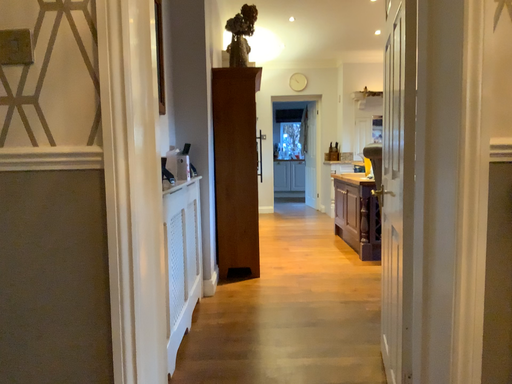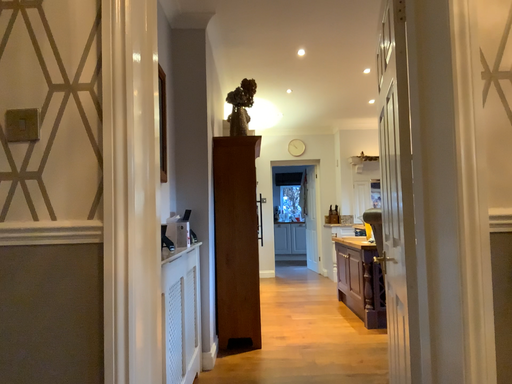
Question: How did the camera likely rotate when shooting the video?

Choices:
 (A) rotated downward
 (B) rotated upward

Answer: (B)